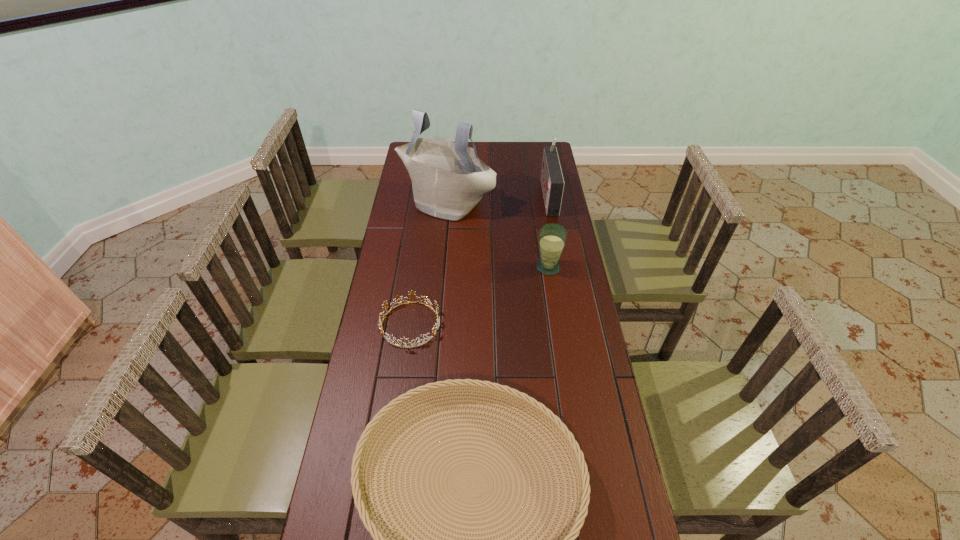
Find the location of a particular element. blank space that satisfies the following two spatial constraints: 1. on the front panel of the radio receiver; 2. on the front-facing side of the shortest object is located at coordinates (571, 325).